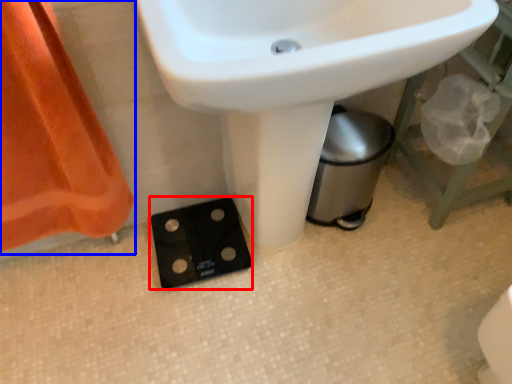
Question: Which object is further to the camera taking this photo, socket (highlighted by a red box) or curtain (highlighted by a blue box)?

Choices:
 (A) socket
 (B) curtain

Answer: (A)